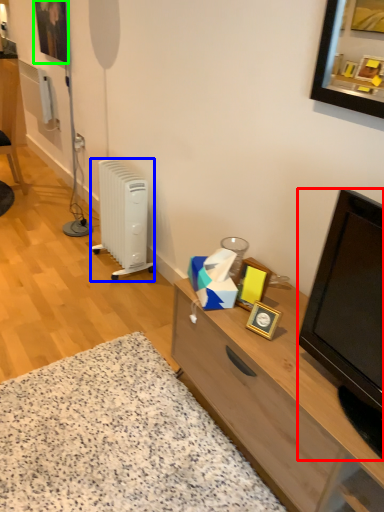
Question: Based on their relative distances, which object is farther from television (highlighted by a red box)? Choose from radiator (highlighted by a blue box) and picture frame (highlighted by a green box).

Choices:
 (A) radiator
 (B) picture frame

Answer: (B)